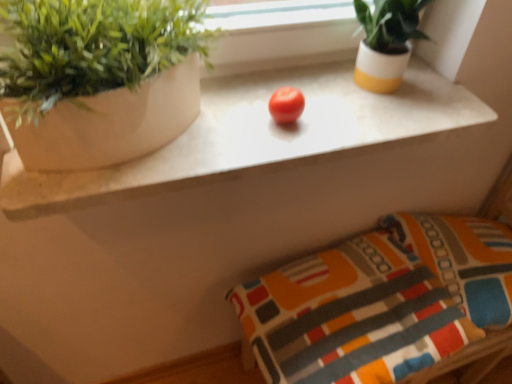
Identify the location of vacant location below matte white pot at upper left (from a real-world perspective). This screenshot has width=512, height=384. (108, 163).